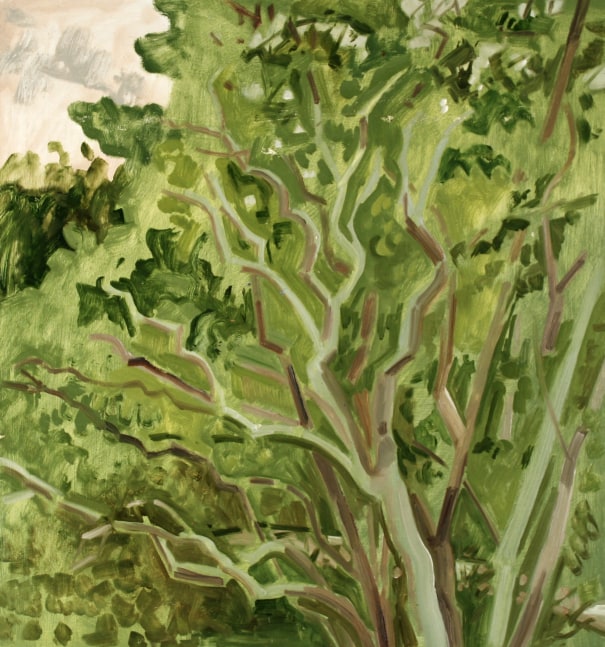
Identify the location of light brown paint. The image size is (605, 647). (564, 484), (456, 424), (175, 344), (327, 598), (299, 562).